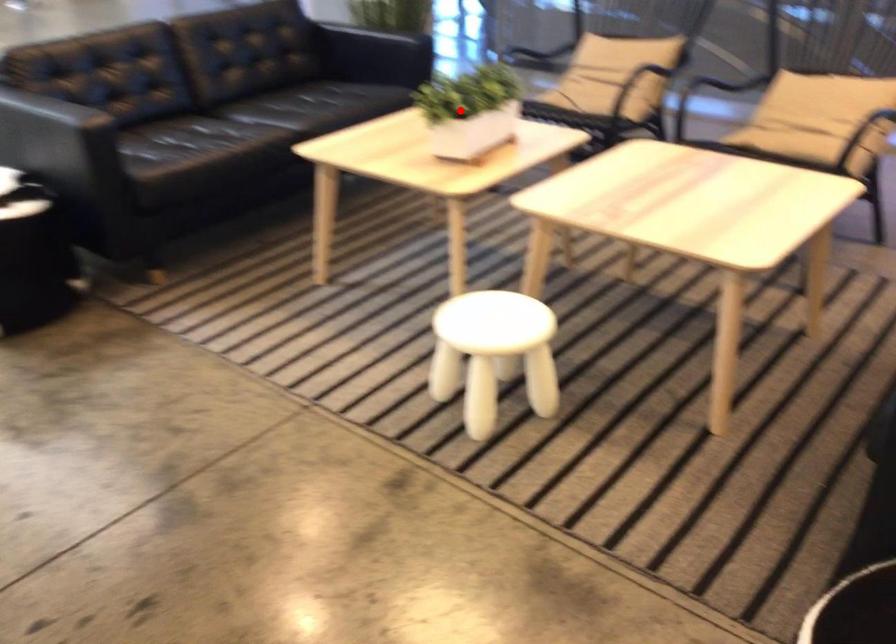
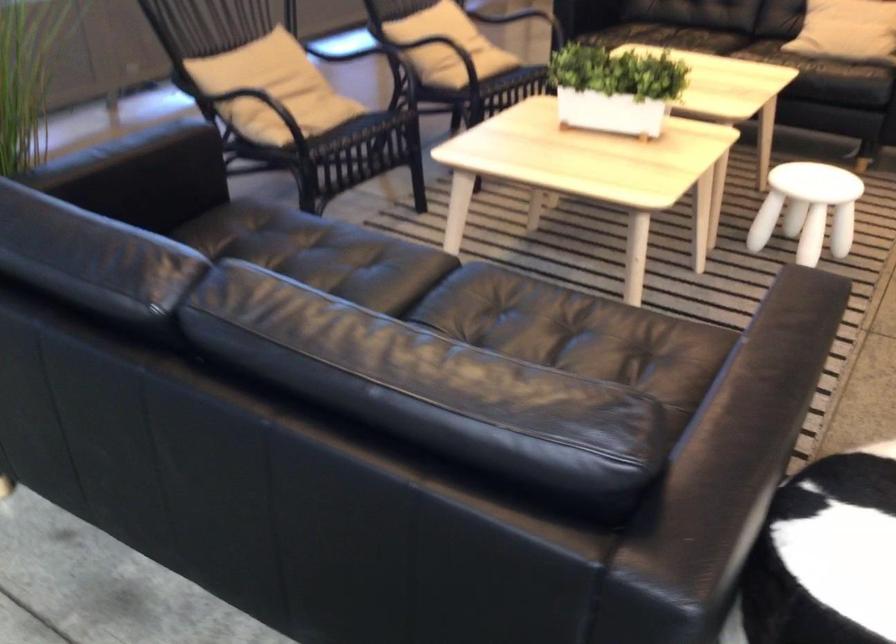
Where in the second image is the point corresponding to the highlighted location from the first image?

(615, 88)